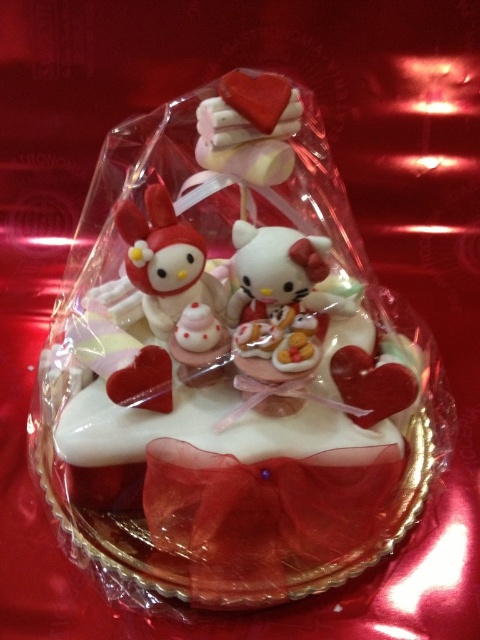
Question: Can you confirm if white glossy cake at center is smaller than matte plastic hello kitty at center?

Choices:
 (A) yes
 (B) no

Answer: (B)

Question: Is white glossy cake at center closer to camera compared to matte plastic hello kitty at center?

Choices:
 (A) yes
 (B) no

Answer: (A)

Question: Which object is closer to the camera taking this photo?

Choices:
 (A) white glossy cake at center
 (B) matte plastic hello kitty at center

Answer: (A)

Question: From the image, what is the correct spatial relationship of white glossy cake at center in relation to matte plastic hello kitty at center?

Choices:
 (A) right
 (B) left

Answer: (A)

Question: Which object appears farthest from the camera in this image?

Choices:
 (A) matte plastic hello kitty at center
 (B) white glossy cake at center

Answer: (A)

Question: Which point is farther from the camera taking this photo?

Choices:
 (A) (83, 337)
 (B) (180, 244)

Answer: (A)